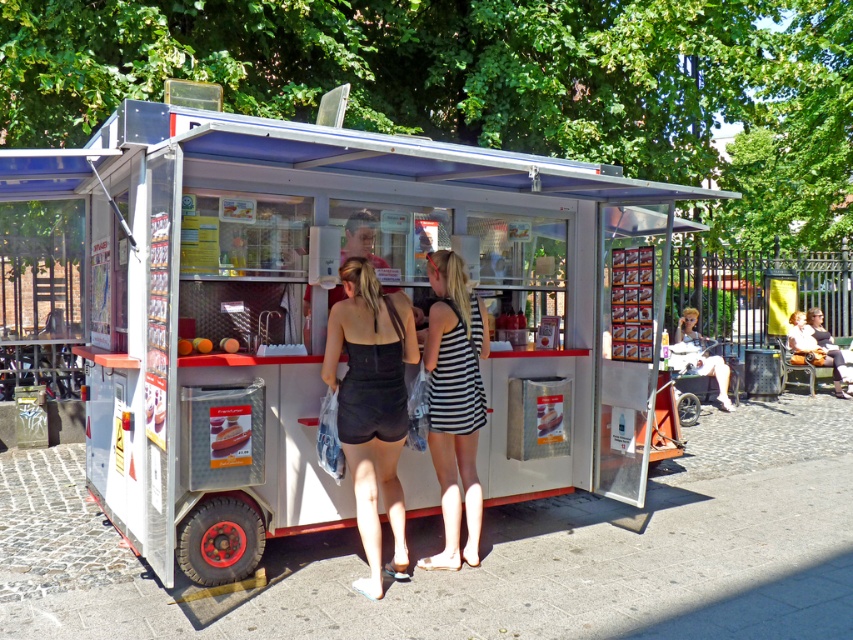
Consider the image. Can you confirm if black matte dress at center is positioned below light brown leather jacket at right?

Yes, black matte dress at center is below light brown leather jacket at right.

Where is `black matte dress at center`? The image size is (853, 640). black matte dress at center is located at coordinates (372, 406).

What do you see at coordinates (372, 406) in the screenshot? The width and height of the screenshot is (853, 640). I see `black matte dress at center` at bounding box center [372, 406].

Where is `black matte dress at center`? black matte dress at center is located at coordinates coord(372,406).

Is striped fabric dress at center in front of light brown leather jacket at right?

Yes, it is.

Who is lower down, striped fabric dress at center or light brown leather jacket at right?

striped fabric dress at center is below.

Does point (445, 529) lie in front of point (836, 381)?

Yes.

You are a GUI agent. You are given a task and a screenshot of the screen. Output one action in this format:
    pyautogui.click(x=<x>, y=<y>)
    Task: Click on the striped fabric dress at center
    
    Given the screenshot: What is the action you would take?
    pyautogui.click(x=456, y=403)

Does white metallic food truck at center appear over light brown leather jacket at right?

Yes.

Can you confirm if white metallic food truck at center is positioned below light brown leather jacket at right?

Actually, white metallic food truck at center is above light brown leather jacket at right.

Who is more distant from viewer, (x=335, y=125) or (x=804, y=339)?

The point (x=804, y=339) is more distant.

You are a GUI agent. You are given a task and a screenshot of the screen. Output one action in this format:
    pyautogui.click(x=<x>, y=<y>)
    Task: Click on the white metallic food truck at center
    
    Given the screenshot: What is the action you would take?
    pyautogui.click(x=323, y=312)